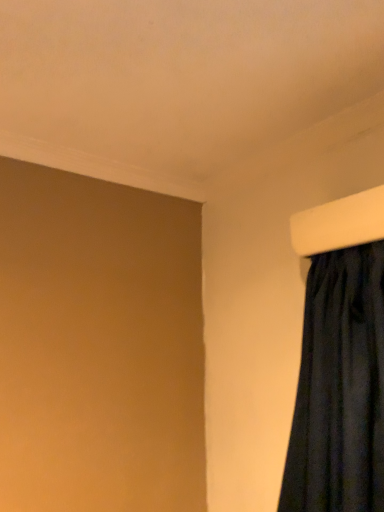
What is the approximate width of black matte curtain at right?

20.19 centimeters.

Where is `black matte curtain at right`? The image size is (384, 512). black matte curtain at right is located at coordinates (339, 388).

What do you see at coordinates (339, 388) in the screenshot? I see `black matte curtain at right` at bounding box center [339, 388].

Where is `black matte curtain at right`? The height and width of the screenshot is (512, 384). black matte curtain at right is located at coordinates (339, 388).